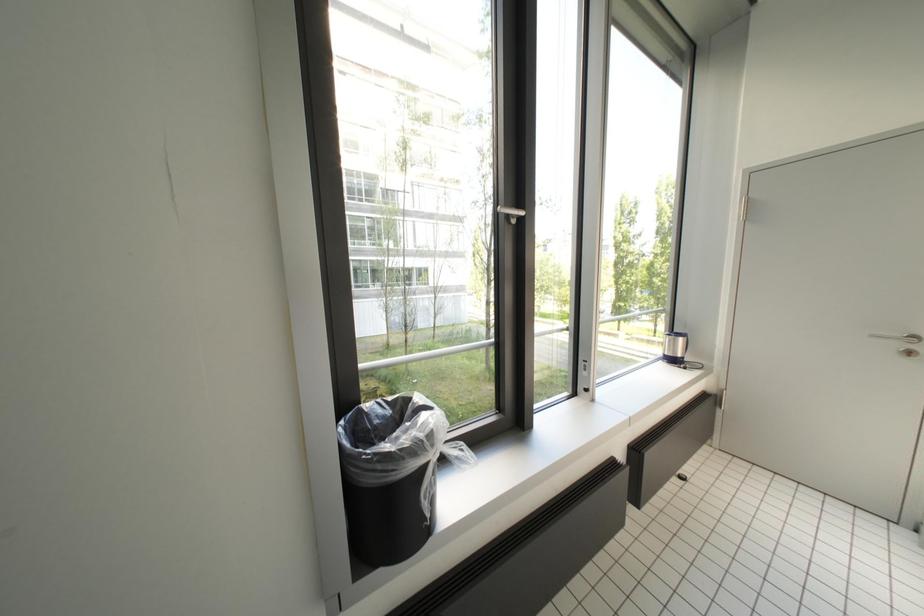
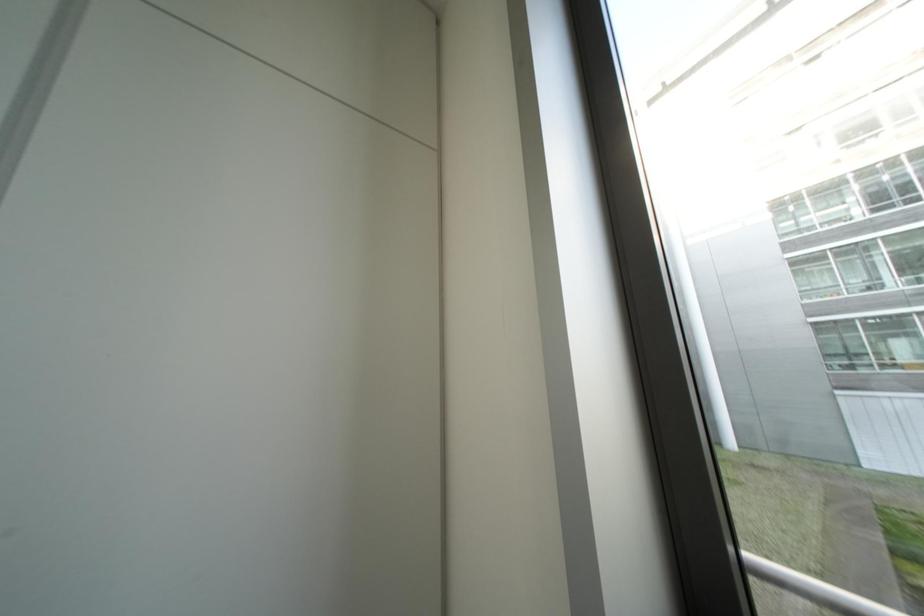
Question: Based on the continuous images, in which direction is the camera rotating? Reply with the corresponding letter.

Choices:
 (A) Left
 (B) Right
 (C) Up
 (D) Down

Answer: (A)